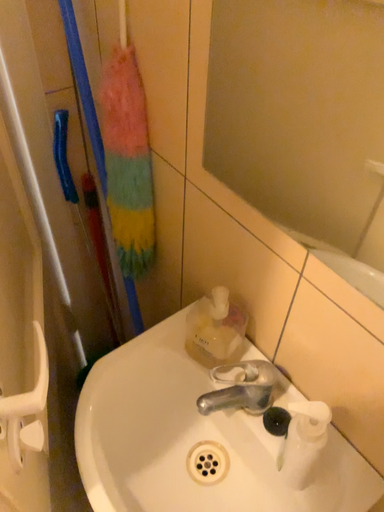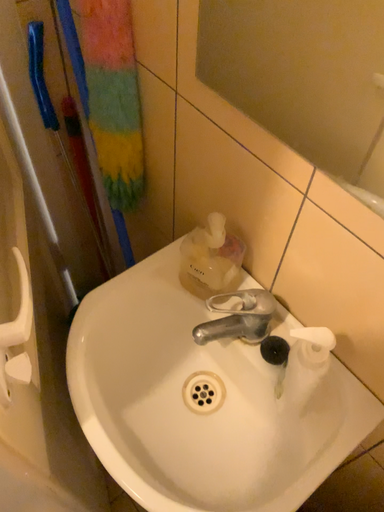
Question: Which way did the camera rotate in the video?

Choices:
 (A) rotated downward
 (B) rotated upward

Answer: (A)